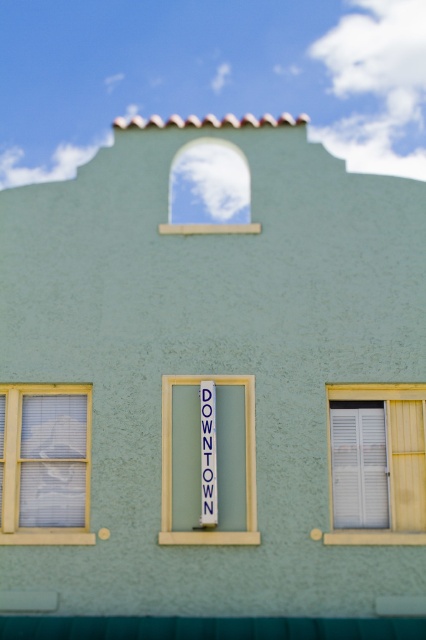
Can you confirm if white matte window at lower left is positioned to the left of blue fabric sign at center?

Correct, you'll find white matte window at lower left to the left of blue fabric sign at center.

Does white matte window at lower left have a larger size compared to blue fabric sign at center?

Indeed, white matte window at lower left has a larger size compared to blue fabric sign at center.

This screenshot has height=640, width=426. What do you see at coordinates (45, 464) in the screenshot? I see `white matte window at lower left` at bounding box center [45, 464].

The height and width of the screenshot is (640, 426). In order to click on white matte window at lower left in this screenshot , I will do `click(45, 464)`.

Is white matte window at lower left closer to camera compared to white glass window at upper center?

Yes, white matte window at lower left is in front of white glass window at upper center.

Between white matte window at lower left and white glass window at upper center, which one appears on the right side from the viewer's perspective?

white glass window at upper center is more to the right.

Identify the location of white matte window at lower left. The image size is (426, 640). (45, 464).

What do you see at coordinates (377, 464) in the screenshot?
I see `white wooden shutters at right` at bounding box center [377, 464].

Does white wooden shutters at right come behind teal matte trim at bottom?

That is True.

Where is `white wooden shutters at right`? The height and width of the screenshot is (640, 426). white wooden shutters at right is located at coordinates (377, 464).